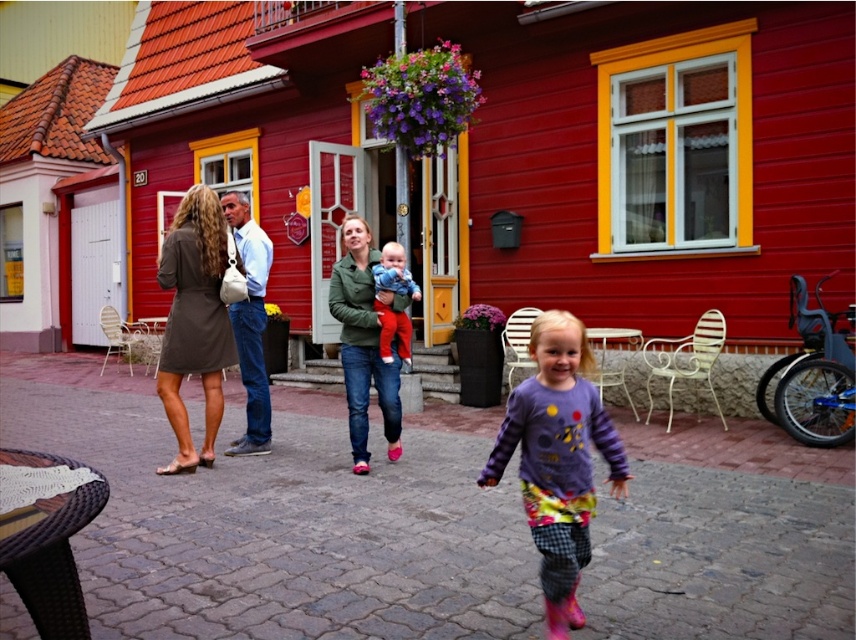
You are a delivery person standing at the entrance of the red wooden house with yellow windows. You need to deliver a package to the person wearing the purple fleece jacket at center. The package must be placed exactly 4 meters away from the matte brown dress at center. Can you place the package correctly?

The purple fleece jacket at center is 3.63 meters from the matte brown dress at center. Since the required distance is 4 meters, the package cannot be placed correctly at that exact distance.